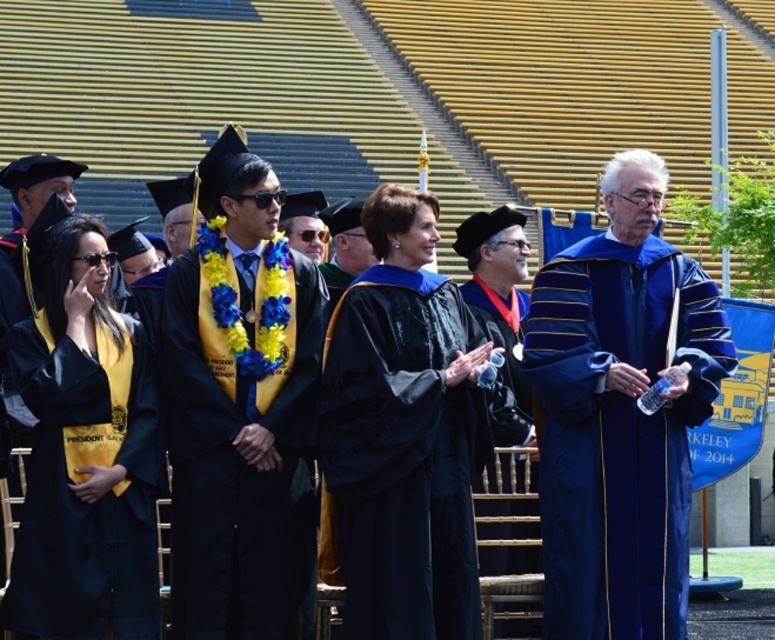
You are a photographer at the graduation ceremony. You need to capture a photo where both the blue velvet gown at center and the matte black robe at center are clearly visible. Given their height difference, which gown will appear larger in the photo?

The blue velvet gown at center is much taller than the matte black robe at center, so it will appear larger in the photo.

You are a photographer at the graduation ceremony and want to capture a photo of both the blue velvet gown at center and the matte black graduation gown at center. Which one is positioned to the right of the other?

The blue velvet gown at center is positioned to the right of the matte black graduation gown at center.

Where is the blue velvet gown at center located in the image?

The blue velvet gown at center is located at point (620, 413).